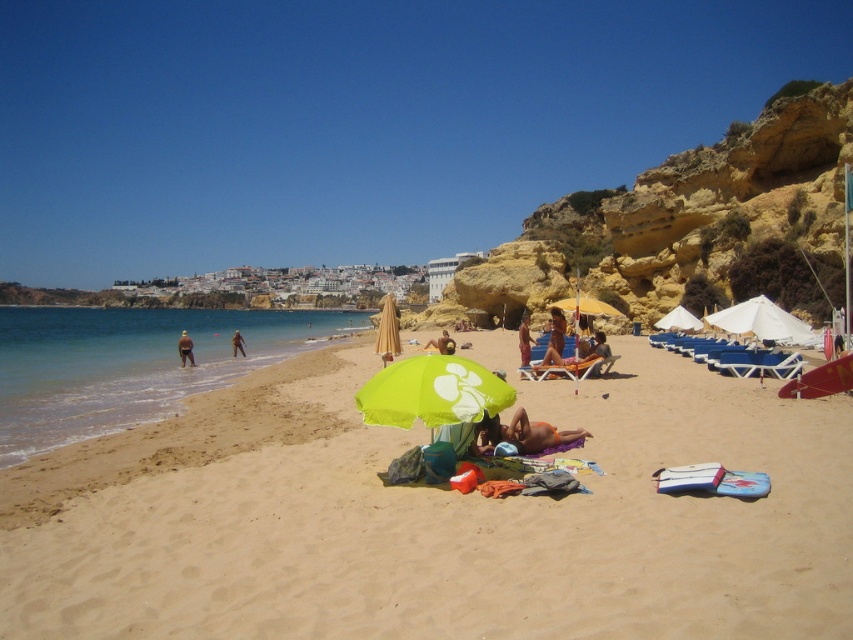
Question: Which is nearer to the light brown sand at center?

Choices:
 (A) smooth tan skin at center
 (B) tan fabric towel at center
 (C) white matte umbrella at center-right
 (D) orange fabric towel at center

Answer: (D)

Question: Which object is positioned closest to the beige fabric umbrella at center?

Choices:
 (A) yellow fabric umbrella at center
 (B) light brown sand at center
 (C) tan fabric towel at center
 (D) orange fabric towel at center

Answer: (A)

Question: Considering the real-world distances, which object is farthest from the tan skin person at left?

Choices:
 (A) white matte umbrella at center-right
 (B) yellow fabric umbrella at center

Answer: (A)

Question: Can you confirm if green fabric umbrella at center is wider than brown textured towel at center?

Choices:
 (A) no
 (B) yes

Answer: (A)

Question: Is the position of beige fabric umbrella at center less distant than that of black fabric person at left?

Choices:
 (A) yes
 (B) no

Answer: (A)

Question: Is clear blue water at lower left closer to camera compared to brown fabric chair at center?

Choices:
 (A) no
 (B) yes

Answer: (B)